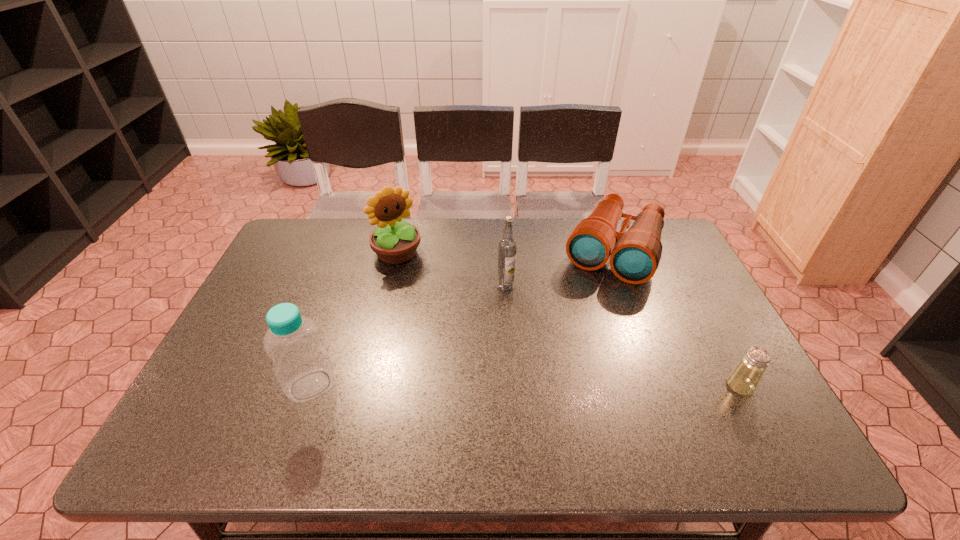
Identify the location of bottle. (302, 366).

Where is `saltshaker`? The height and width of the screenshot is (540, 960). saltshaker is located at coordinates (744, 379).

This screenshot has height=540, width=960. I want to click on vodka, so click(x=507, y=247).

I want to click on sunflower, so click(394, 241).

Identify the location of the second shortest object. (635, 254).

Where is `vacant space located 0.330m on the back of the bottle`? vacant space located 0.330m on the back of the bottle is located at coordinates (348, 278).

Find the location of a particular element. The height and width of the screenshot is (540, 960). vacant space located 0.140m on the left of the shortest object is located at coordinates (667, 386).

Where is `vacant space located 0.400m on the label of the third object from right to left`? This screenshot has height=540, width=960. vacant space located 0.400m on the label of the third object from right to left is located at coordinates (522, 417).

Locate an element on the screen. blank area located on the label of the third object from right to left is located at coordinates (521, 409).

Where is `vacant space situated on the label of the third object from right to left`? The width and height of the screenshot is (960, 540). vacant space situated on the label of the third object from right to left is located at coordinates (513, 343).